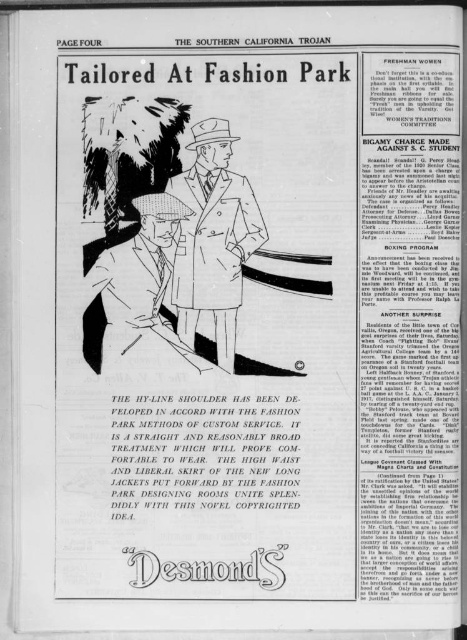
Based on the vintage newspaper page from The Southern California Trojan, you are a tailor who needs to determine which suit requires more fabric to make between the light brown striped suit at center and the matte gray suit at center. Which one would you choose?

The matte gray suit at center requires more fabric because its width is greater than the light brown striped suit at center.

You are a fashion designer looking at this vintage page from The Southern California Trojan. You notice two suits at the center of the illustration. Which suit is closer to you, the light brown striped suit at center or the matte gray suit at center?

The light brown striped suit at center is closer to you because it is in front of the matte gray suit at center.